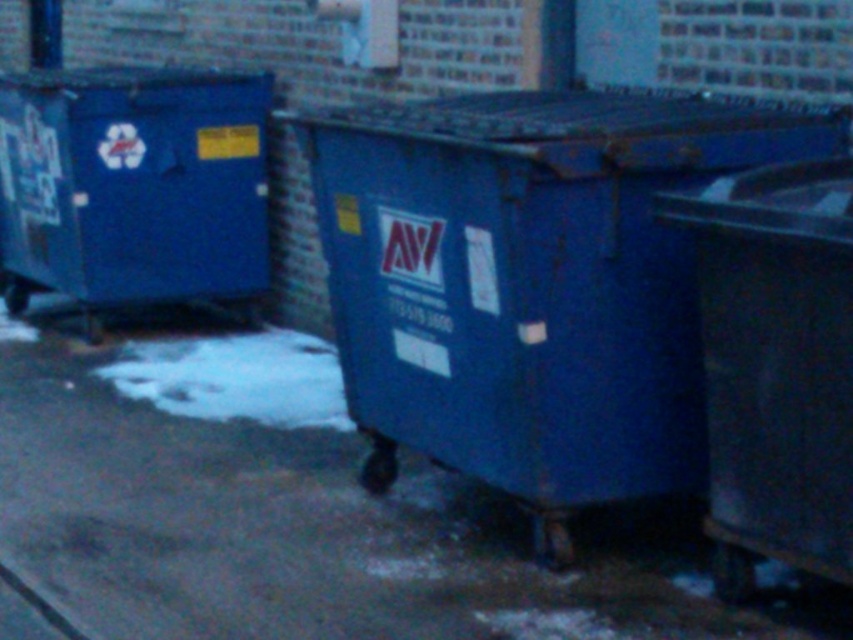
Between slick asphalt pavement at center and blue matte dumpster at center, which one has less height?

slick asphalt pavement at center

Which is below, slick asphalt pavement at center or blue matte dumpster at center?

slick asphalt pavement at center is below.

Does point (12, 376) come closer to viewer compared to point (474, 99)?

No, it is not.

Locate an element on the screen. slick asphalt pavement at center is located at coordinates (303, 509).

Does slick asphalt pavement at center have a lesser height compared to matte blue recycling bin at left?

Indeed, slick asphalt pavement at center has a lesser height compared to matte blue recycling bin at left.

Does slick asphalt pavement at center appear on the right side of matte blue recycling bin at left?

Indeed, slick asphalt pavement at center is positioned on the right side of matte blue recycling bin at left.

Does point (57, 401) come farther from viewer compared to point (39, 100)?

No, it is not.

You are a GUI agent. You are given a task and a screenshot of the screen. Output one action in this format:
    pyautogui.click(x=<x>, y=<y>)
    Task: Click on the slick asphalt pavement at center
    The image size is (853, 640).
    Given the screenshot: What is the action you would take?
    pyautogui.click(x=303, y=509)

Does rusty metal dumpster at right have a greater height compared to matte blue recycling bin at left?

In fact, rusty metal dumpster at right may be shorter than matte blue recycling bin at left.

Is point (780, 420) positioned in front of point (39, 115)?

Yes, it is in front of point (39, 115).

Which is behind, point (808, 502) or point (119, 236)?

The point (119, 236) is more distant.

The height and width of the screenshot is (640, 853). In order to click on rusty metal dumpster at right in this screenshot , I will do `click(775, 364)`.